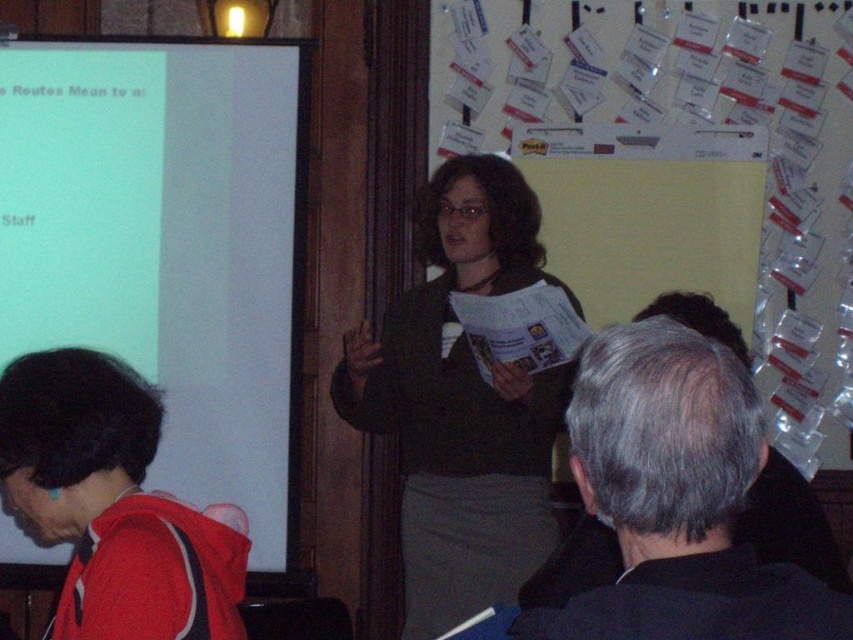
Who is shorter, white matte projection screen at left or gray hair at upper right?

gray hair at upper right is shorter.

This screenshot has width=853, height=640. What are the coordinates of `white matte projection screen at left` in the screenshot? It's located at (163, 244).

At what (x,y) coordinates should I click in order to perform the action: click on white matte projection screen at left. Please return your answer as a coordinate pair (x, y). Looking at the image, I should click on (163, 244).

Can you confirm if white matte projection screen at left is bigger than white paperboard at upper center?

No.

The width and height of the screenshot is (853, 640). I want to click on white matte projection screen at left, so click(x=163, y=244).

Between point (271, 173) and point (802, 326), which one is positioned in front?

Point (271, 173) is more forward.

You are a GUI agent. You are given a task and a screenshot of the screen. Output one action in this format:
    pyautogui.click(x=<x>, y=<y>)
    Task: Click on the white matte projection screen at left
    This screenshot has height=640, width=853.
    Given the screenshot: What is the action you would take?
    pyautogui.click(x=163, y=244)

Which is more to the right, white matte projection screen at left or matte black jacket at center?

matte black jacket at center

Who is more distant from viewer, (x=107, y=212) or (x=450, y=214)?

The point (x=107, y=212) is more distant.

Who is more forward, (129, 58) or (508, 580)?

Positioned in front is point (508, 580).

I want to click on white matte projection screen at left, so click(x=163, y=244).